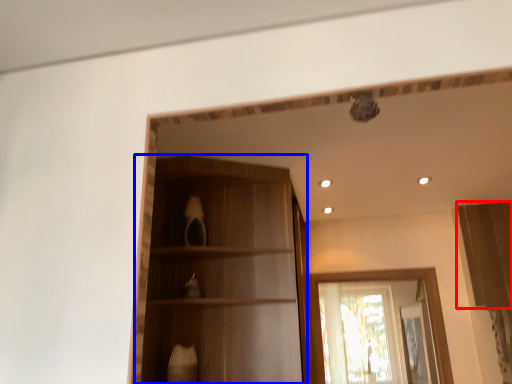
Question: Which object appears farthest to the camera in this image, cabinetry (highlighted by a red box) or cabinetry (highlighted by a blue box)?

Choices:
 (A) cabinetry
 (B) cabinetry

Answer: (A)